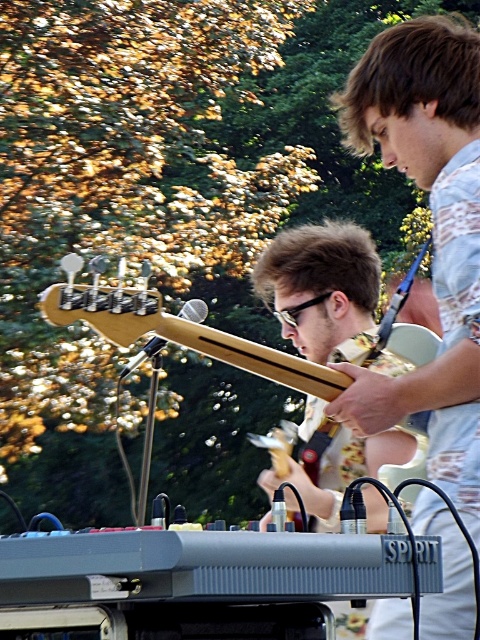
Question: Which point appears farthest from the camera in this image?

Choices:
 (A) (344, 253)
 (B) (151, 292)

Answer: (A)

Question: Is matte wood guitar at center positioned at the back of light wood electric guitar at center?

Choices:
 (A) yes
 (B) no

Answer: (A)

Question: Considering the relative positions of matte wood guitar at center and light wood electric guitar at center in the image provided, where is matte wood guitar at center located with respect to light wood electric guitar at center?

Choices:
 (A) left
 (B) right

Answer: (B)

Question: Does matte wood guitar at center have a lesser width compared to light wood electric guitar at center?

Choices:
 (A) yes
 (B) no

Answer: (A)